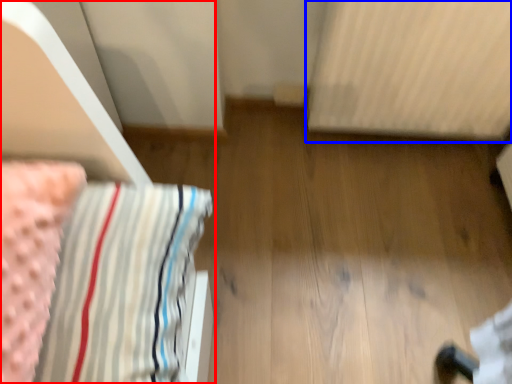
Question: Among these objects, which one is farthest to the camera, furniture (highlighted by a red box) or radiator (highlighted by a blue box)?

Choices:
 (A) furniture
 (B) radiator

Answer: (B)